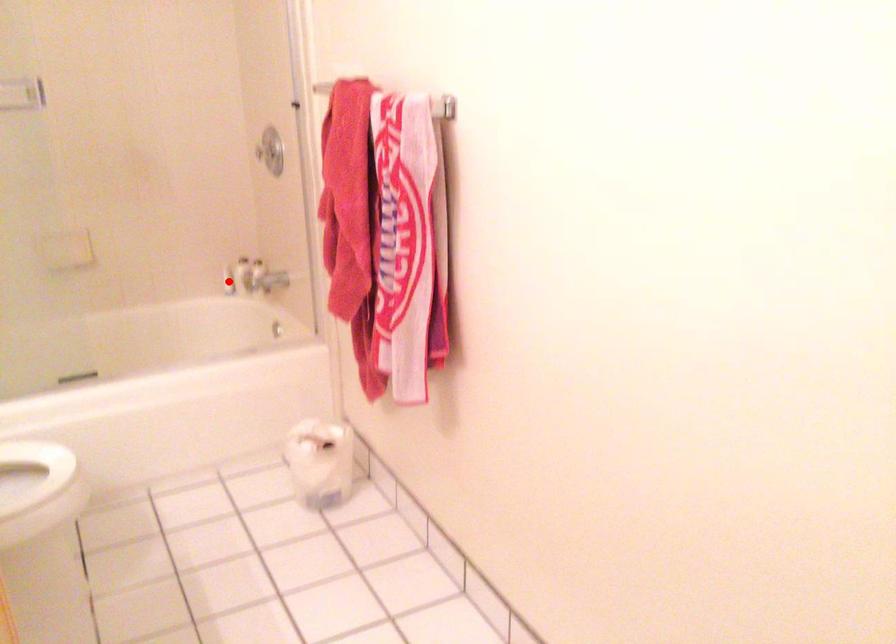
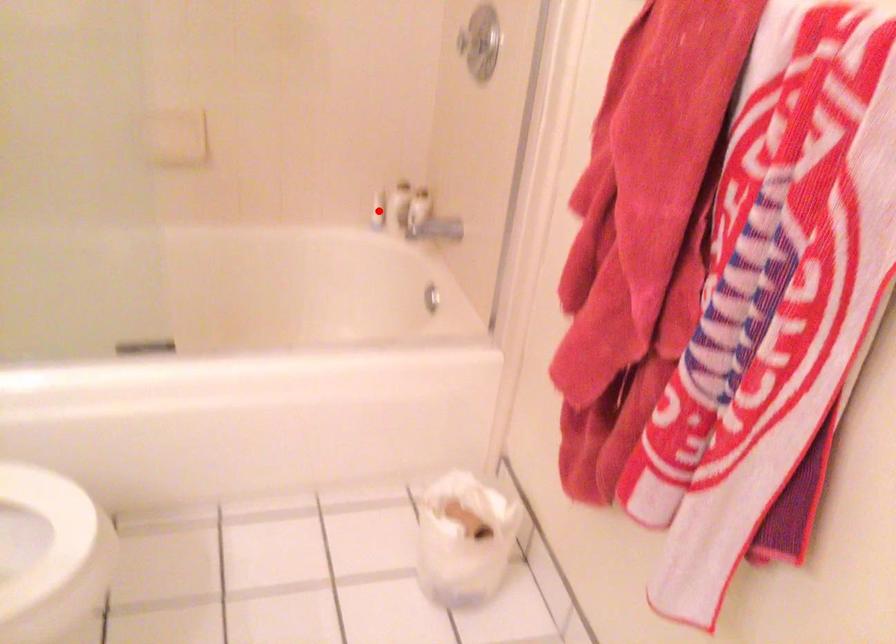
I am providing you with two images of the same scene from different viewpoints. A red point is marked on the first image and another point is marked on the second image. Is the marked point in image1 the same physical position as the marked point in image2?

Yes